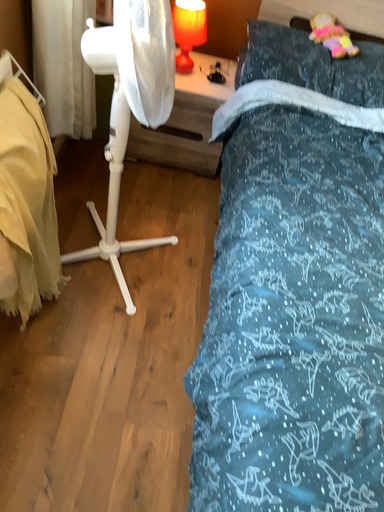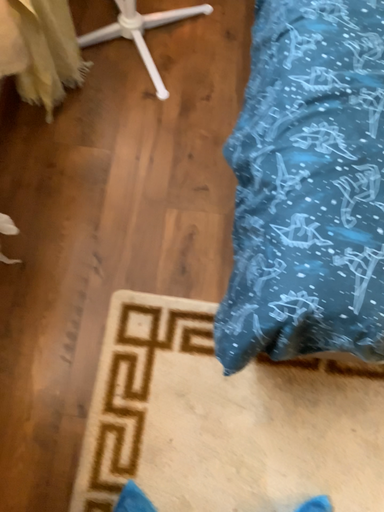
Question: How did the camera likely rotate when shooting the video?

Choices:
 (A) rotated downward
 (B) rotated upward

Answer: (A)